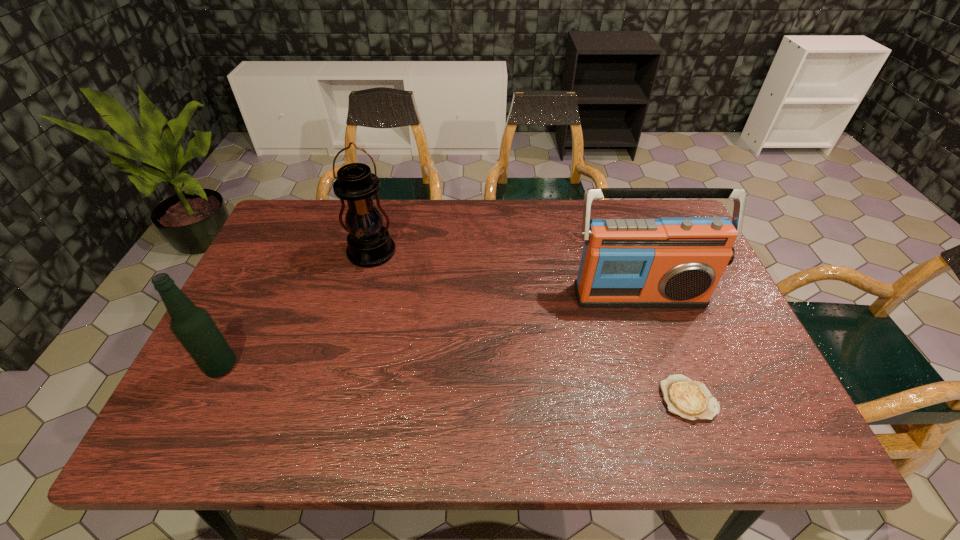
Image resolution: width=960 pixels, height=540 pixels. In order to click on the third object from right to left in this screenshot , I will do `click(369, 244)`.

At what (x,y) coordinates should I click in order to perform the action: click on lantern. Please return your answer as a coordinate pair (x, y). Looking at the image, I should click on (369, 244).

I want to click on radio receiver, so click(x=672, y=262).

Locate an element on the screen. The height and width of the screenshot is (540, 960). the leftmost object is located at coordinates (192, 325).

At what (x,y) coordinates should I click in order to perform the action: click on the shortest object. Please return your answer as a coordinate pair (x, y). Looking at the image, I should click on (x=691, y=400).

What is the location of a free spot located 0.140m above the lantern, indicating its light source? Please provide its 2D coordinates. Your answer should be formatted as a tuple, i.e. [(x, y)], where the tuple contains the x and y coordinates of a point satisfying the conditions above.

[(357, 308)]

Locate an element on the screen. free space located on the front-facing side of the radio receiver is located at coordinates (689, 442).

This screenshot has width=960, height=540. I want to click on vacant space located 0.060m on the back of the leftmost object, so click(x=238, y=334).

Identify the location of free space located on the back of the quiche. (654, 304).

Locate an element on the screen. object that is at the far edge is located at coordinates (369, 244).